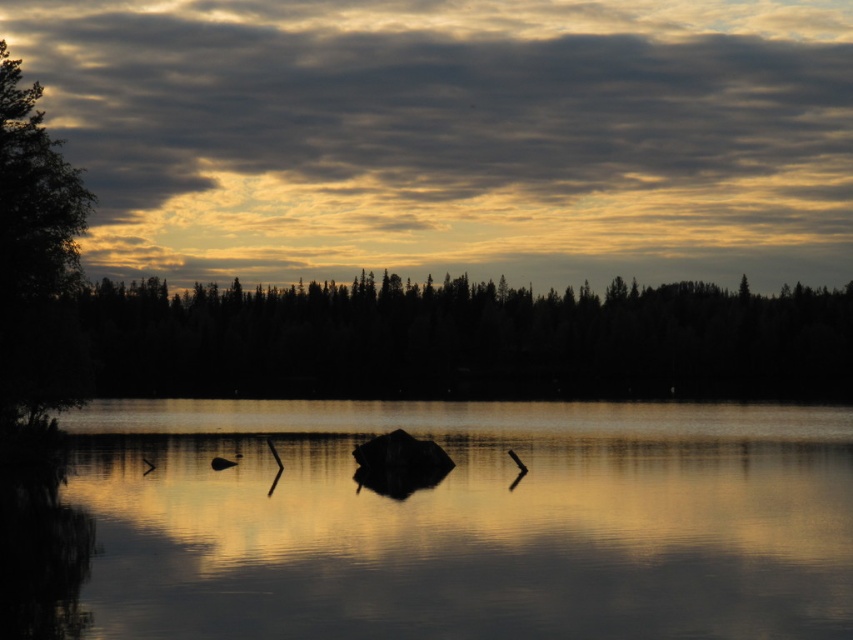
You are a photographer planning to capture the cloudy sky at upper center and the smooth water at center in a single shot. Based on their relative sizes in the image, which object would appear larger in the photo?

The cloudy sky at upper center appears larger in the photo because it is taller than the smooth water at center.

You are standing at the lakeside and want to determine the relative positions of two points on the lake. The first point is labeled as point (108, 531) and the second is point (770, 312). Based on the scene, which point is closer to you?

Point (108, 531) is in front of point (770, 312), so it is closer to you.